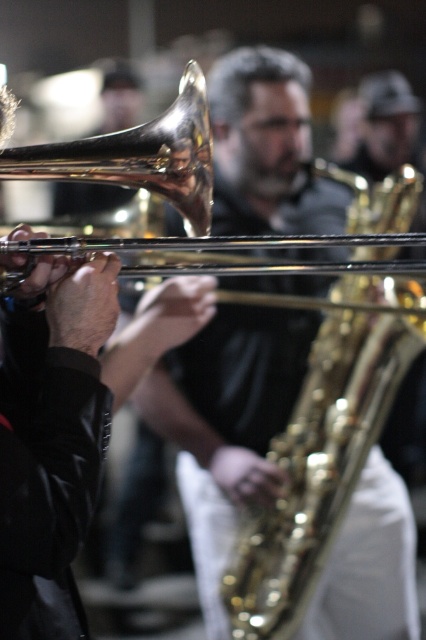
Question: Is gold shiny trumpet at center wider than shiny brass trombone at center?

Choices:
 (A) no
 (B) yes

Answer: (B)

Question: Which of the following is the farthest from the observer?

Choices:
 (A) (115, 140)
 (B) (307, 388)

Answer: (B)

Question: Can you confirm if gold shiny trumpet at center is thinner than shiny brass trombone at center?

Choices:
 (A) no
 (B) yes

Answer: (A)

Question: Is gold shiny trumpet at center bigger than shiny brass trombone at center?

Choices:
 (A) yes
 (B) no

Answer: (A)

Question: Among these points, which one is farthest from the camera?

Choices:
 (A) (85, 166)
 (B) (310, 516)

Answer: (B)

Question: Which point is closer to the camera?

Choices:
 (A) shiny brass trombone at center
 (B) gold shiny trumpet at center

Answer: (A)